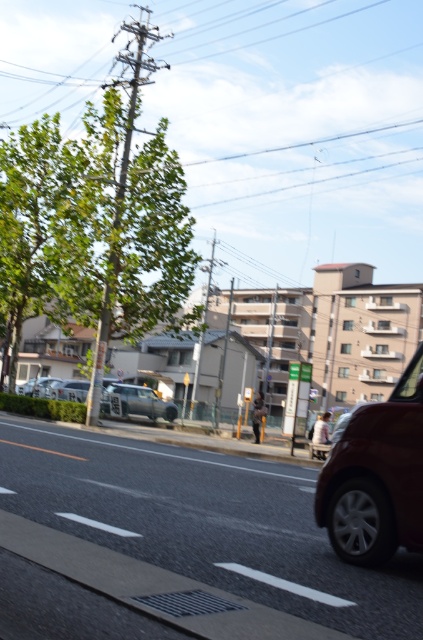
Question: Is satin silver car at center closer to camera compared to silver metallic car at center?

Choices:
 (A) yes
 (B) no

Answer: (B)

Question: Which point appears farthest from the camera in this image?

Choices:
 (A) (357, 504)
 (B) (142, 404)
 (C) (41, 387)

Answer: (C)

Question: Among these objects, which one is farthest from the camera?

Choices:
 (A) silver metallic car at center
 (B) matte silver car at center
 (C) satin silver car at center

Answer: (B)

Question: Is silver metallic car at center bigger than matte silver car at center?

Choices:
 (A) yes
 (B) no

Answer: (B)

Question: Can you confirm if satin red car at right is wider than satin silver car at center?

Choices:
 (A) yes
 (B) no

Answer: (B)

Question: Which point is farther from the camera taking this photo?

Choices:
 (A) (43, 394)
 (B) (161, 403)
 (C) (57, 394)

Answer: (A)